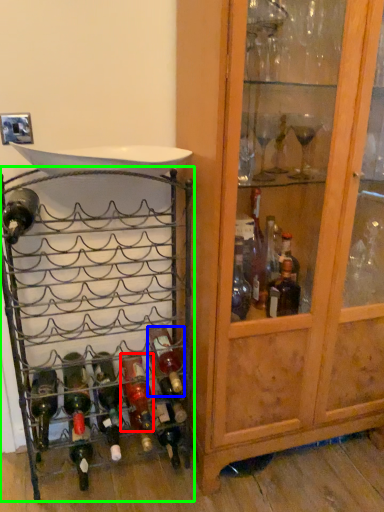
Question: Which is nearer to the bottle (highlighted by a red box)? bottle (highlighted by a blue box) or shelf (highlighted by a green box).

Choices:
 (A) bottle
 (B) shelf

Answer: (A)